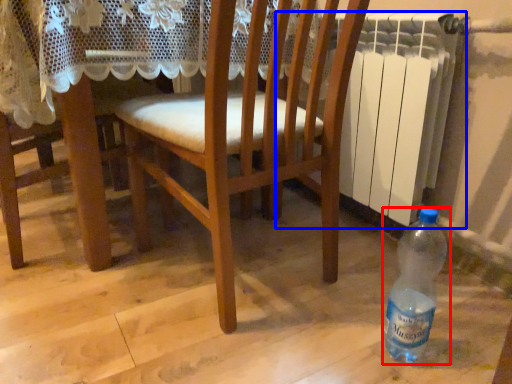
Question: Which of the following is the closest to the observer, bottle (highlighted by a red box) or radiator (highlighted by a blue box)?

Choices:
 (A) bottle
 (B) radiator

Answer: (A)